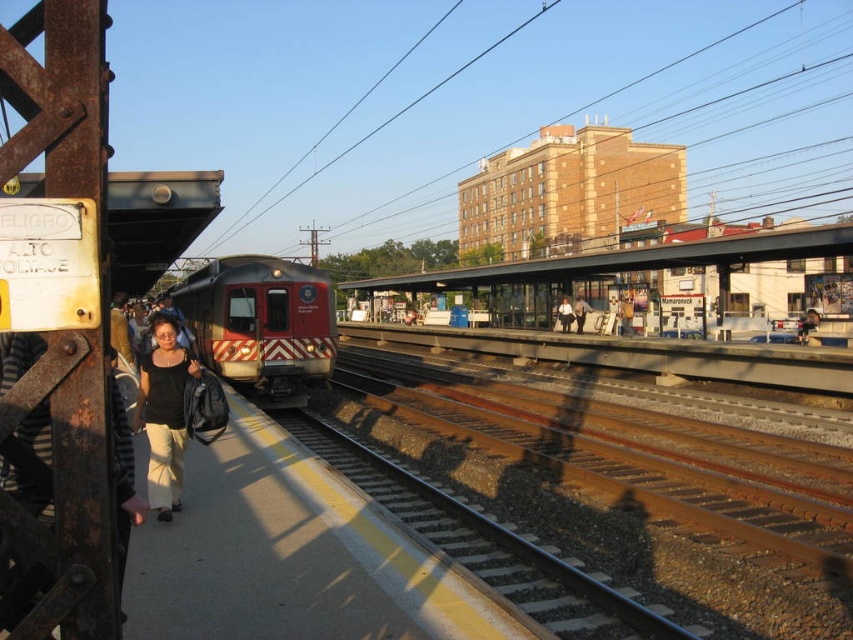
Which of these two, black cotton shirt at center or smooth black shirt at center, stands taller?

smooth black shirt at center is taller.

Between point (155, 400) and point (798, 330), which one is positioned in front?

Point (155, 400)

The image size is (853, 640). Find the location of `black cotton shirt at center`. black cotton shirt at center is located at coordinates (164, 413).

Based on the photo, is rusty metal track at center wider than smooth black shirt at center?

Yes.

Is rusty metal track at center taller than smooth black shirt at center?

No.

Describe the element at coordinates (628, 490) in the screenshot. I see `rusty metal track at center` at that location.

Image resolution: width=853 pixels, height=640 pixels. Find the location of `rusty metal track at center`. rusty metal track at center is located at coordinates (628, 490).

Who is more distant from viewer, (563, 307) or (575, 298)?

Positioned behind is point (575, 298).

Is dark blue jeans at center shorter than matte black jacket at center?

Correct, dark blue jeans at center is not as tall as matte black jacket at center.

Is point (566, 308) farther from viewer compared to point (576, 314)?

Yes, it is behind point (576, 314).

Find the location of a particular element. dark blue jeans at center is located at coordinates (566, 314).